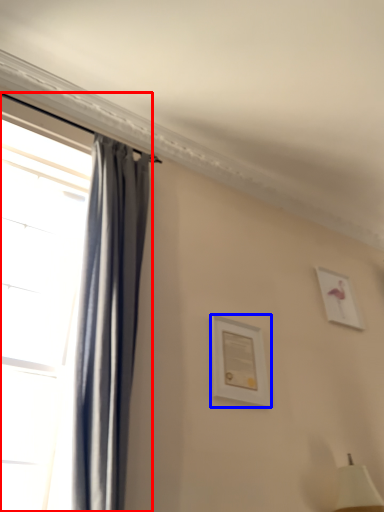
Question: Which object appears farthest to the camera in this image, window (highlighted by a red box) or picture frame (highlighted by a blue box)?

Choices:
 (A) window
 (B) picture frame

Answer: (B)